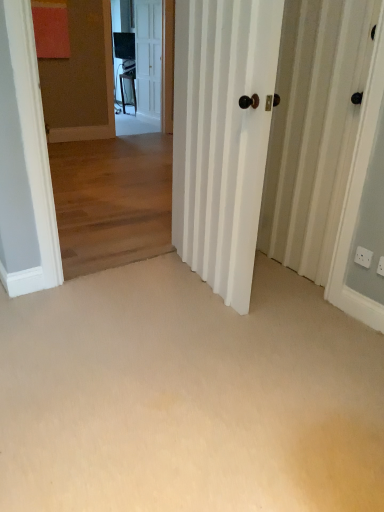
Question: Should I look upward or downward to see white glossy screen door at upper center?

Choices:
 (A) up
 (B) down

Answer: (A)

Question: From the image's perspective, would you say white glossy screen door at upper center is shown under white wooden door at upper center, which appears as the first door when viewed from the left?

Choices:
 (A) no
 (B) yes

Answer: (B)

Question: From a real-world perspective, does white glossy screen door at upper center stand above white wooden door at upper center, placed as the 1th door when sorted from back to front?

Choices:
 (A) yes
 (B) no

Answer: (B)

Question: From the image's perspective, is white glossy screen door at upper center on top of white wooden door at upper center, which ranks as the 2th door in front-to-back order?

Choices:
 (A) no
 (B) yes

Answer: (A)

Question: Is white glossy screen door at upper center shorter than white wooden door at upper center, placed as the 1th door when sorted from back to front?

Choices:
 (A) no
 (B) yes

Answer: (B)

Question: Is white glossy screen door at upper center positioned far away from white wooden door at upper center, the second door positioned from the right?

Choices:
 (A) yes
 (B) no

Answer: (B)

Question: Is white glossy screen door at upper center surrounding white wooden door at upper center, which ranks as the 2th door in front-to-back order?

Choices:
 (A) no
 (B) yes

Answer: (A)

Question: From a real-world perspective, is white glossy door at center, which appears as the first door when viewed from the right, on top of white glossy screen door at upper center?

Choices:
 (A) no
 (B) yes

Answer: (A)

Question: Is white glossy door at center, which appears as the first door when viewed from the right, to the left of white glossy screen door at upper center from the viewer's perspective?

Choices:
 (A) yes
 (B) no

Answer: (B)

Question: From a real-world perspective, is white glossy door at center, the second door positioned from the back, positioned under white glossy screen door at upper center based on gravity?

Choices:
 (A) yes
 (B) no

Answer: (A)

Question: Does white glossy door at center, the second door positioned from the back, turn towards white glossy screen door at upper center?

Choices:
 (A) yes
 (B) no

Answer: (B)

Question: From the image's perspective, does white glossy door at center, the second door positioned from the back, appear lower than white glossy screen door at upper center?

Choices:
 (A) no
 (B) yes

Answer: (B)

Question: Is white glossy door at center, which appears as the 2th door when viewed from the left, smaller than white glossy screen door at upper center?

Choices:
 (A) no
 (B) yes

Answer: (A)

Question: Is white glossy screen door at upper center in front of white plastic electric outlet at lower right, the first electric outlet viewed from the front?

Choices:
 (A) yes
 (B) no

Answer: (B)